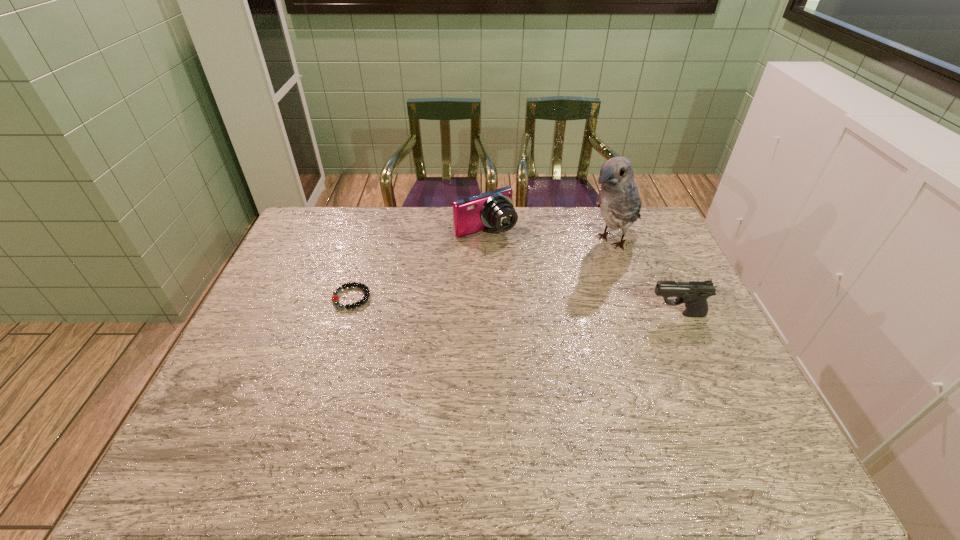
Where is `bracelet`? The width and height of the screenshot is (960, 540). bracelet is located at coordinates (335, 298).

The height and width of the screenshot is (540, 960). I want to click on the leftmost object, so click(335, 298).

Find the location of a particular element. This screenshot has height=540, width=960. pistol is located at coordinates (694, 294).

Where is `the tallest object`? The height and width of the screenshot is (540, 960). the tallest object is located at coordinates (618, 199).

Locate an element on the screen. The image size is (960, 540). the third object from right to left is located at coordinates (494, 209).

The height and width of the screenshot is (540, 960). I want to click on vacant space situated on the back of the shortest object, so click(374, 225).

This screenshot has width=960, height=540. What are the coordinates of `vacant region located 0.380m at the barrel of the pistol` in the screenshot? It's located at (515, 315).

Locate an element on the screen. This screenshot has width=960, height=540. vacant space positioned 0.180m at the barrel of the pistol is located at coordinates (585, 315).

The height and width of the screenshot is (540, 960). Find the location of `free space located at the barrel of the pistol`. free space located at the barrel of the pistol is located at coordinates (578, 315).

You are a GUI agent. You are given a task and a screenshot of the screen. Output one action in this format:
    pyautogui.click(x=<x>, y=<y>)
    Task: Click on the vacant space located 0.370m on the front-facing side of the tallest object
    
    Given the screenshot: What is the action you would take?
    pyautogui.click(x=515, y=310)